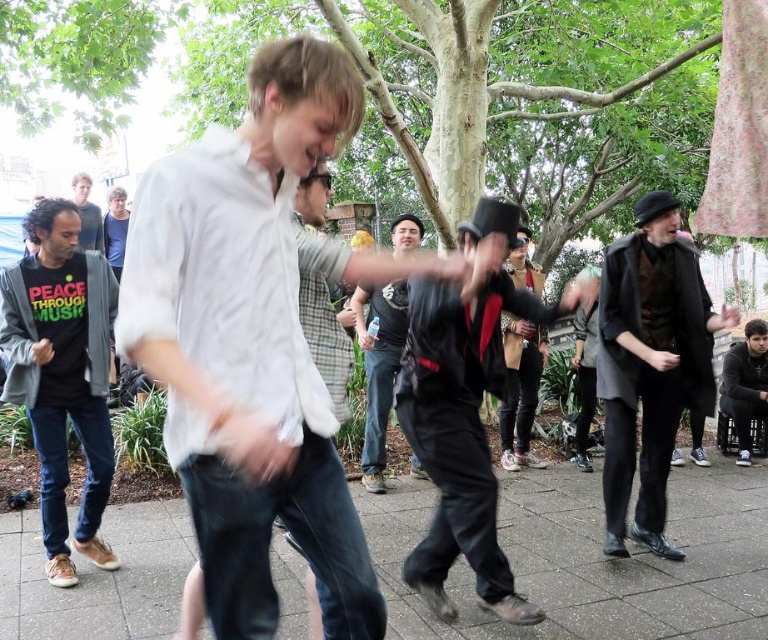
Between point (568, 529) and point (752, 412), which one is positioned in front?

Point (568, 529) is in front.

Does gray concrete pavement at center come in front of dark gray hoodie at lower right?

Yes, gray concrete pavement at center is in front of dark gray hoodie at lower right.

Is point (447, 634) less distant than point (753, 346)?

Yes, it is in front of point (753, 346).

Image resolution: width=768 pixels, height=640 pixels. In order to click on gray concrete pavement at center in this screenshot , I will do `click(593, 557)`.

Where is `gray concrete pavement at center`? This screenshot has width=768, height=640. gray concrete pavement at center is located at coordinates (593, 557).

Where is `gray concrete pavement at center`? Image resolution: width=768 pixels, height=640 pixels. gray concrete pavement at center is located at coordinates (593, 557).

This screenshot has height=640, width=768. In order to click on gray concrete pavement at center in this screenshot , I will do `click(593, 557)`.

Is white cotton shirt at center taller than matte black shirt at center?

Indeed, white cotton shirt at center has a greater height compared to matte black shirt at center.

Can you confirm if white cotton shirt at center is positioned to the left of matte black shirt at center?

No, white cotton shirt at center is not to the left of matte black shirt at center.

Between point (458, 268) and point (84, 234), which one is positioned behind?

The point (84, 234) is more distant.

Find the location of a particular element. The image size is (768, 640). white cotton shirt at center is located at coordinates (250, 346).